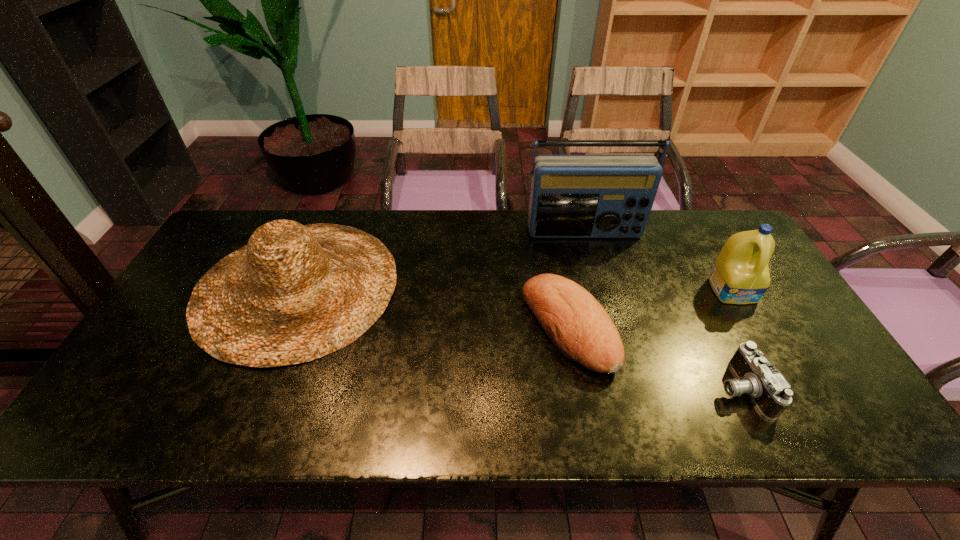
Identify the location of free space located at the lens of the camera. The image size is (960, 540). (597, 388).

Where is `vacant space located at the lens of the camera`? The image size is (960, 540). vacant space located at the lens of the camera is located at coordinates (602, 388).

Where is `free spot located at the lens of the camera`? The image size is (960, 540). free spot located at the lens of the camera is located at coordinates (563, 388).

Where is `radio receiver that is positioned at the far edge`? The image size is (960, 540). radio receiver that is positioned at the far edge is located at coordinates (572, 196).

Where is `sunhat present at the far edge`? This screenshot has width=960, height=540. sunhat present at the far edge is located at coordinates (295, 293).

At what (x,y) coordinates should I click in order to perform the action: click on object that is positioned at the near edge. Please return your answer as a coordinate pair (x, y). The height and width of the screenshot is (540, 960). Looking at the image, I should click on (770, 392).

Identify the location of object at the left edge. The image size is (960, 540). (295, 293).

The image size is (960, 540). What are the coordinates of `object at the right edge` in the screenshot? It's located at (740, 275).

The height and width of the screenshot is (540, 960). I want to click on object present at the far left corner, so click(295, 293).

What are the coordinates of `free space at the far edge of the desktop` in the screenshot? It's located at (372, 225).